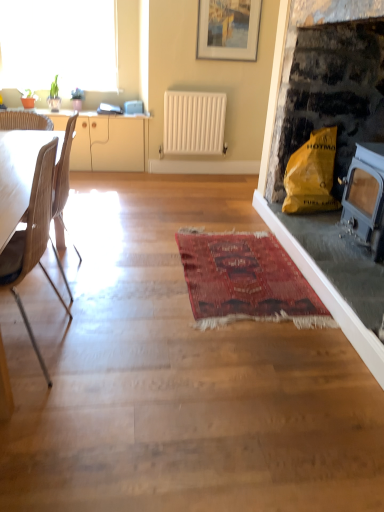
I want to click on space that is in front of red woven rug at center, so click(227, 374).